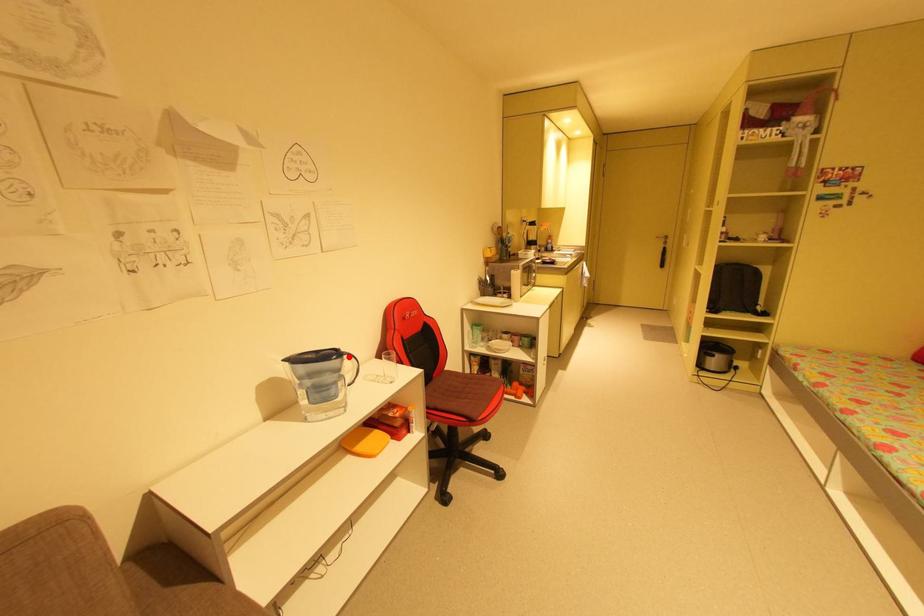
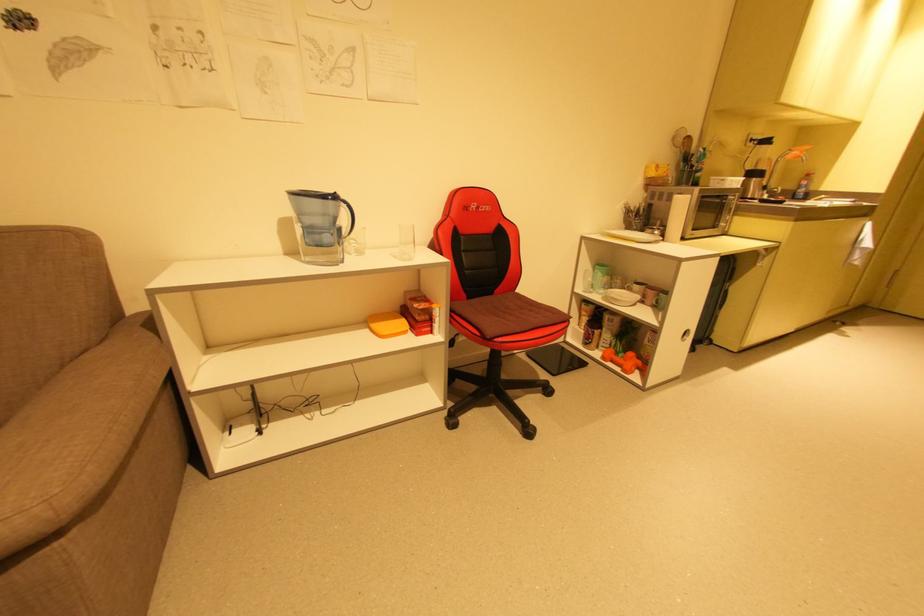
The point at the highlighted location is marked in the first image. Where is the corresponding point in the second image?

(346, 204)